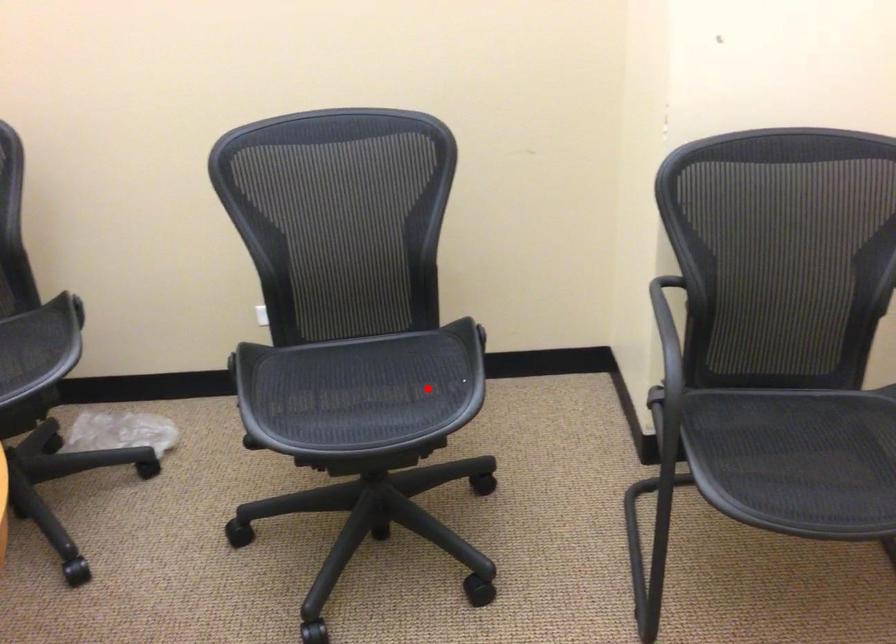
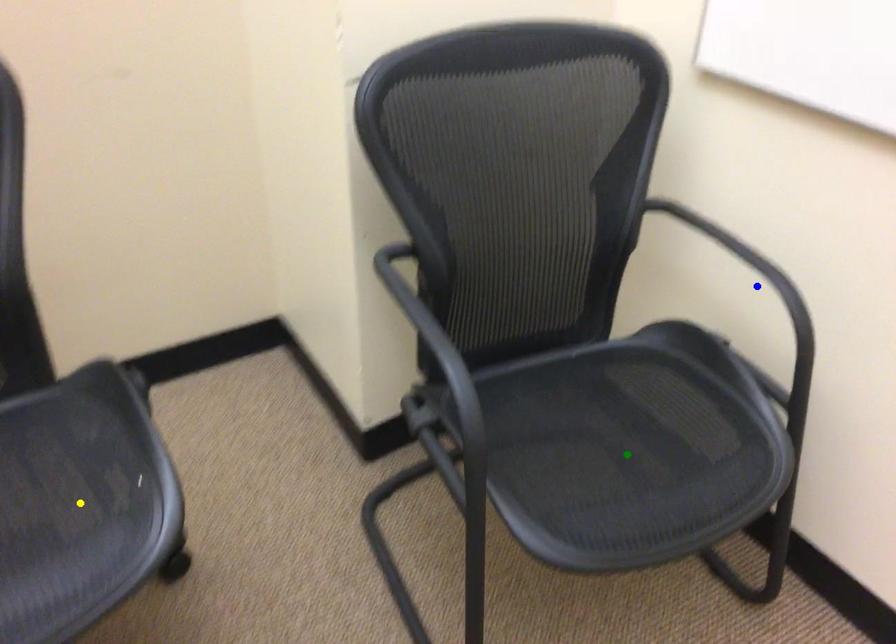
Question: I am providing you with two images of the same scene from different viewpoints. A red point is marked on the first image. You are given multiple points on the second image. Which spot in image 2 lines up with the point in image 1?

Choices:
 (A) green point
 (B) yellow point
 (C) blue point

Answer: (B)